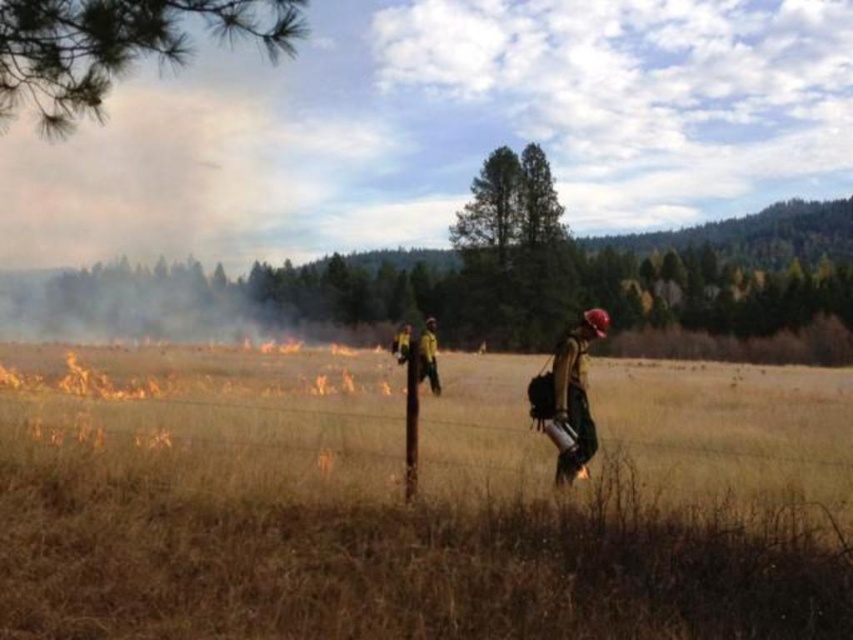
You are a drone operator trying to capture a clear photo of the firefighting equipment in the scene. The drone is currently positioned above the dry field. Which object, the matte brown helmet at right or the yellow reflective vest at center, will appear smaller in the photo due to its position?

The matte brown helmet at right will appear smaller in the photo because it has a lesser height compared to the yellow reflective vest at center.

You are a drone operator tasked with monitoring the fire. You notice two objects at the center of the image. Which one is bigger, the brown dry grass at center or the yellow reflective vest at center?

The brown dry grass at center is larger in size compared to the yellow reflective vest at center.